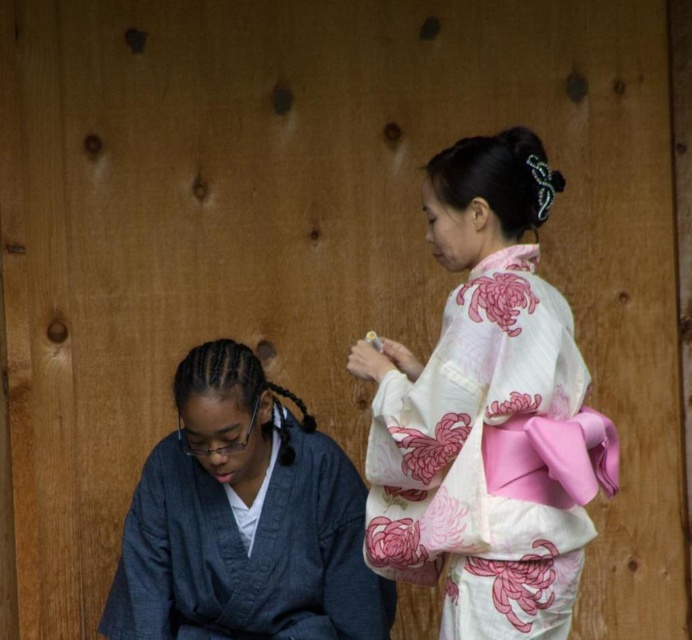
From the picture: You are a photographer setting up a shoot in this scene. You need to adjust the camera focus so that both the white floral kimono at right and the denim robe at lower left are in focus. Given their heights, which object should you focus on first to ensure both are sharp?

The white floral kimono at right is taller than the denim robe at lower left. To ensure both are in focus, you should focus on the white floral kimono at right first, as its greater height means its center will be further away from the camera, optimizing depth of field for both objects.

You are a photographer trying to capture a clear shot of both the white floral kimono at right and the denim robe at lower left. Which one will appear larger in your photo?

The white floral kimono at right will appear larger in the photo because it is closer to the viewer than the denim robe at lower left.